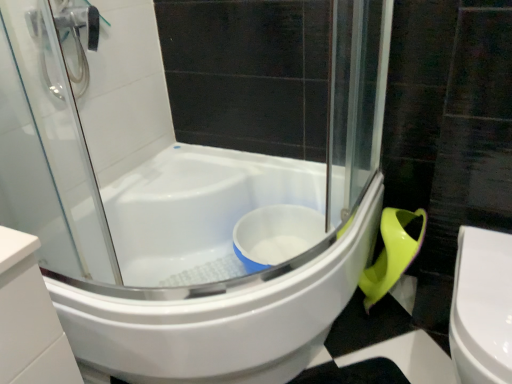
Question: Is white glossy bathtub at center bigger or smaller than white glossy toilet at lower right?

Choices:
 (A) big
 (B) small

Answer: (A)

Question: In the image, is white glossy bathtub at center positioned in front of or behind white glossy toilet at lower right?

Choices:
 (A) behind
 (B) front

Answer: (A)

Question: Considering the positions of point (130, 211) and point (494, 296), is point (130, 211) closer or farther from the camera than point (494, 296)?

Choices:
 (A) closer
 (B) farther

Answer: (B)

Question: Is point (478, 347) positioned closer to the camera than point (133, 301)?

Choices:
 (A) closer
 (B) farther

Answer: (A)

Question: Is white glossy toilet at lower right in front of or behind white glossy bathtub at center in the image?

Choices:
 (A) front
 (B) behind

Answer: (A)

Question: Would you say white glossy toilet at lower right is to the left or to the right of white glossy bathtub at center in the picture?

Choices:
 (A) left
 (B) right

Answer: (B)

Question: Considering the positions of white glossy toilet at lower right and white glossy bathtub at center in the image, is white glossy toilet at lower right bigger or smaller than white glossy bathtub at center?

Choices:
 (A) big
 (B) small

Answer: (B)